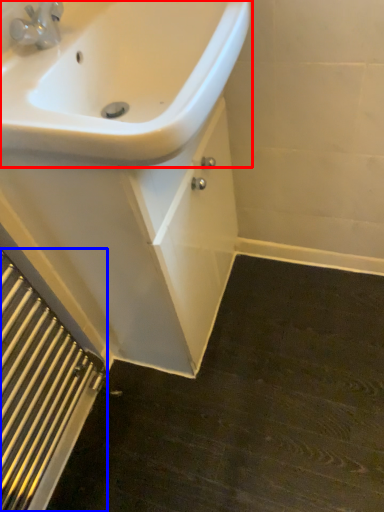
Question: Which object appears closest to the camera in this image, sink (highlighted by a red box) or radiator (highlighted by a blue box)?

Choices:
 (A) sink
 (B) radiator

Answer: (A)